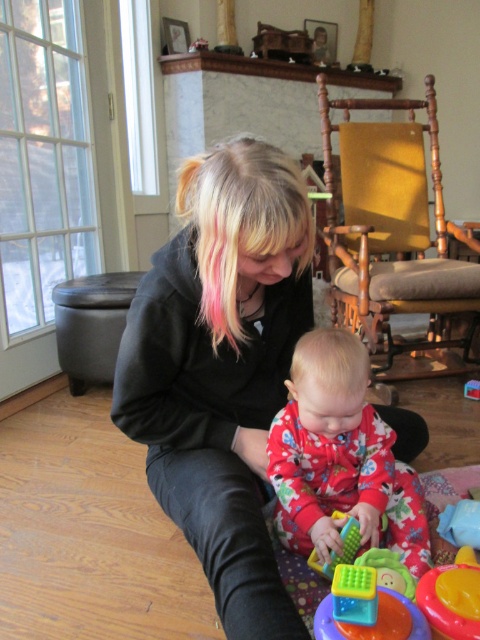
Can you confirm if black matte jacket at center is smaller than green plastic cube at lower center?

No, black matte jacket at center is not smaller than green plastic cube at lower center.

Who is lower down, black matte jacket at center or green plastic cube at lower center?

green plastic cube at lower center is below.

Between point (183, 298) and point (466, 621), which one is positioned behind?

Point (183, 298)

Where is `black matte jacket at center`? Image resolution: width=480 pixels, height=640 pixels. black matte jacket at center is located at coordinates (222, 369).

Who is taller, fluffy red pajamas at center or blonde silky hair at center?

fluffy red pajamas at center

In the scene shown: Which is above, fluffy red pajamas at center or blonde silky hair at center?

blonde silky hair at center is higher up.

Measure the distance between fluffy red pajamas at center and camera.

3.34 feet

Image resolution: width=480 pixels, height=640 pixels. Identify the location of fluffy red pajamas at center. (339, 458).

Is black matte jacket at center below blonde silky hair at center?

Actually, black matte jacket at center is above blonde silky hair at center.

Is black matte jacket at center to the right of blonde silky hair at center from the viewer's perspective?

Incorrect, black matte jacket at center is not on the right side of blonde silky hair at center.

What do you see at coordinates (222, 369) in the screenshot? I see `black matte jacket at center` at bounding box center [222, 369].

The width and height of the screenshot is (480, 640). Find the location of `black matte jacket at center`. black matte jacket at center is located at coordinates (222, 369).